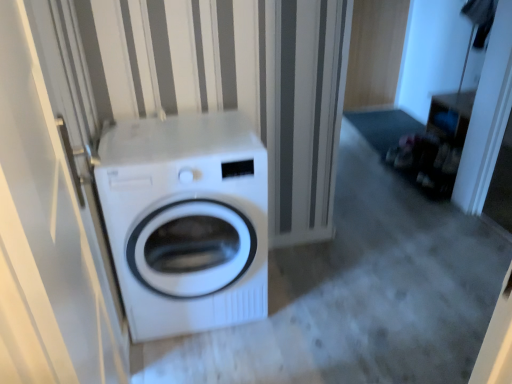
You are a GUI agent. You are given a task and a screenshot of the screen. Output one action in this format:
    pyautogui.click(x=<x>, y=<y>)
    Task: Click on the blank space situated above white glossy washing machine at center (from a real-world perspective)
    
    Given the screenshot: What is the action you would take?
    pyautogui.click(x=182, y=134)